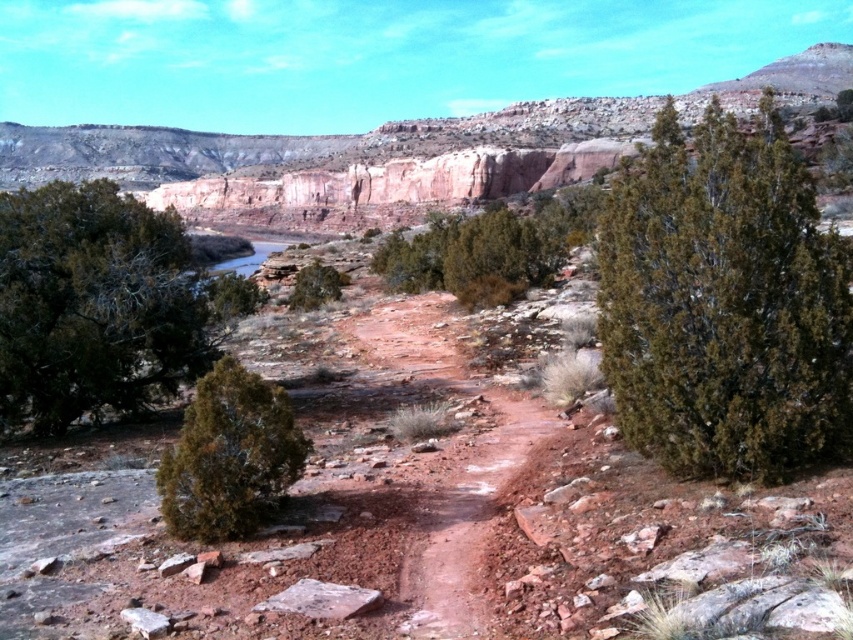
Image resolution: width=853 pixels, height=640 pixels. What do you see at coordinates (490, 248) in the screenshot?
I see `green matte bush at center` at bounding box center [490, 248].

Measure the distance between green matte bush at center and camera.

green matte bush at center and camera are 111.50 meters apart.

What are the coordinates of `green matte bush at center` in the screenshot? It's located at (490, 248).

Is dark green bush at upper right further to the viewer compared to green matte tree at left?

That is False.

Measure the distance between dark green bush at upper right and camera.

dark green bush at upper right and camera are 188.63 feet apart from each other.

Is point (846, 339) positioned behind point (30, 193)?

No, it is not.

Image resolution: width=853 pixels, height=640 pixels. Identify the location of dark green bush at upper right. (724, 304).

Does green matte tree at left have a larger size compared to green matte bush at center?

Incorrect, green matte tree at left is not larger than green matte bush at center.

Who is higher up, green matte tree at left or green matte bush at center?

Positioned higher is green matte bush at center.

I want to click on green matte tree at left, so click(x=94, y=305).

Locate an element on the screen. The image size is (853, 640). green matte tree at left is located at coordinates (94, 305).